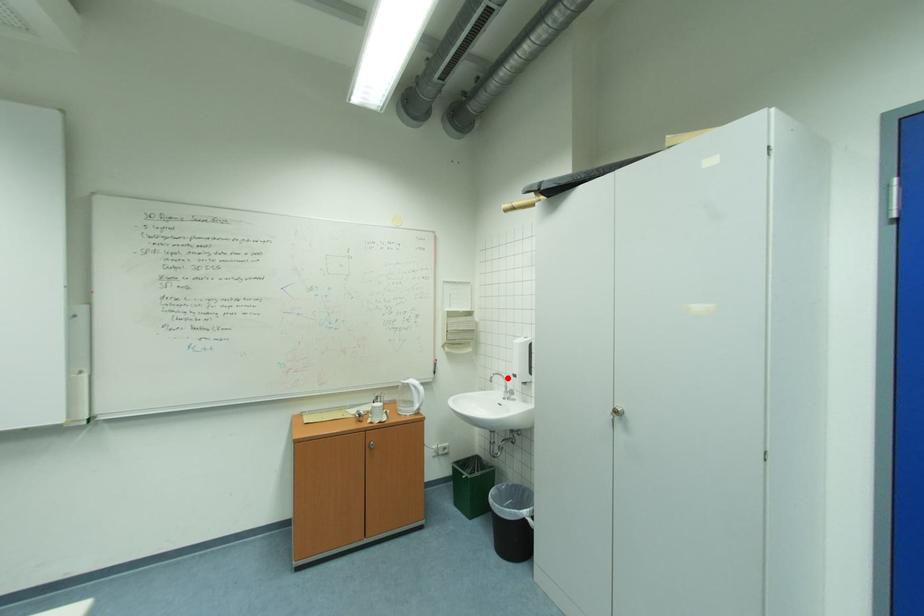
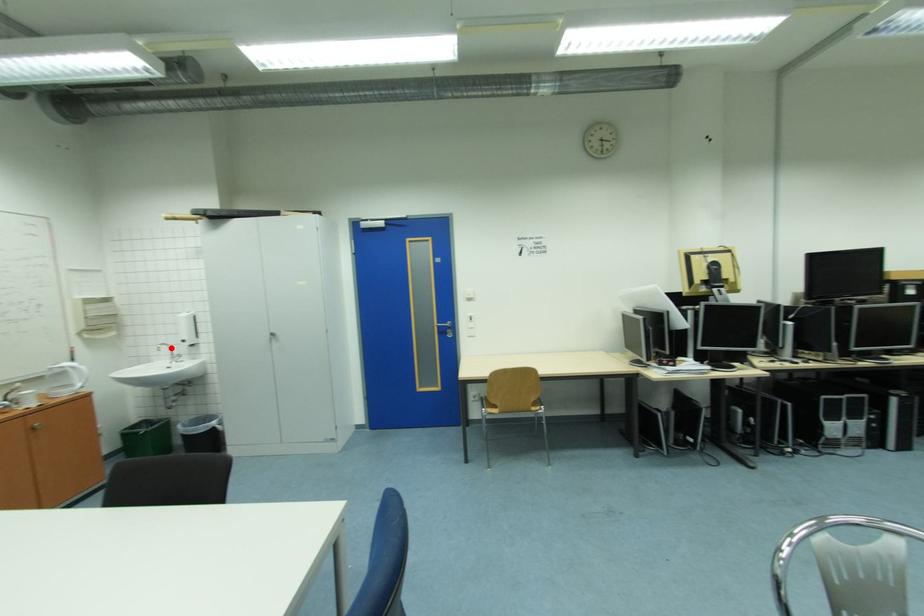
I am providing you with two images of the same scene from different viewpoints. A red point is marked on the first image and another point is marked on the second image. Is the red point in image1 aligned with the point shown in image2?

Yes